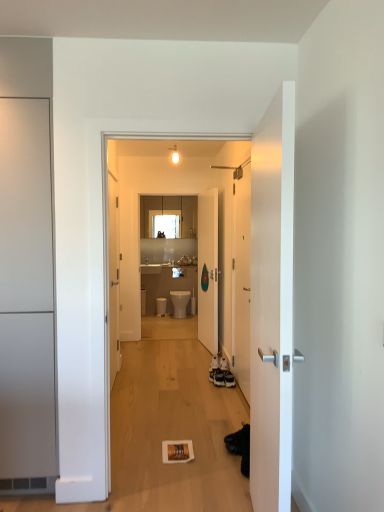
Question: Considering the relative positions of white glossy sink at center and white matte door at left, which is the 4th door from right to left, in the image provided, is white glossy sink at center to the left of white matte door at left, which is the 4th door from right to left, from the viewer's perspective?

Choices:
 (A) yes
 (B) no

Answer: (B)

Question: Is the position of white glossy sink at center more distant than that of white matte door at left, which appears as the 3th door when viewed from the back?

Choices:
 (A) yes
 (B) no

Answer: (A)

Question: Is white matte door at left, which is the 4th door from right to left, inside white glossy sink at center?

Choices:
 (A) no
 (B) yes

Answer: (A)

Question: Is white glossy sink at center next to white matte door at left, placed as the 2th door when sorted from front to back, and touching it?

Choices:
 (A) no
 (B) yes

Answer: (A)

Question: Considering the relative sizes of white glossy sink at center and white matte door at left, which appears as the first door when viewed from the left, in the image provided, is white glossy sink at center thinner than white matte door at left, which appears as the first door when viewed from the left,?

Choices:
 (A) no
 (B) yes

Answer: (B)

Question: Is white glossy sink at center positioned before white matte door at left, which appears as the 3th door when viewed from the back?

Choices:
 (A) no
 (B) yes

Answer: (A)

Question: From a real-world perspective, does white glossy toilet at center sit lower than white glossy sink at center?

Choices:
 (A) yes
 (B) no

Answer: (A)

Question: Is the depth of white glossy toilet at center less than that of white glossy sink at center?

Choices:
 (A) no
 (B) yes

Answer: (B)

Question: Is white glossy toilet at center not inside white glossy sink at center?

Choices:
 (A) yes
 (B) no

Answer: (A)

Question: Would you say white glossy toilet at center contains white glossy sink at center?

Choices:
 (A) yes
 (B) no

Answer: (B)

Question: Can you confirm if white glossy toilet at center is bigger than white glossy sink at center?

Choices:
 (A) no
 (B) yes

Answer: (B)

Question: Does white glossy toilet at center have a greater width compared to white glossy sink at center?

Choices:
 (A) no
 (B) yes

Answer: (B)

Question: Is white matte door at left, placed as the 2th door when sorted from front to back, taller than matte wood cabinets at upper center?

Choices:
 (A) no
 (B) yes

Answer: (B)